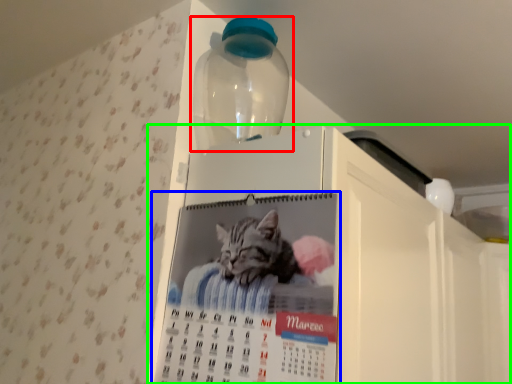
Question: Based on their relative distances, which object is farther from bottle (highlighted by a red box)? Choose from poster (highlighted by a blue box) and appliance (highlighted by a green box).

Choices:
 (A) poster
 (B) appliance

Answer: (A)